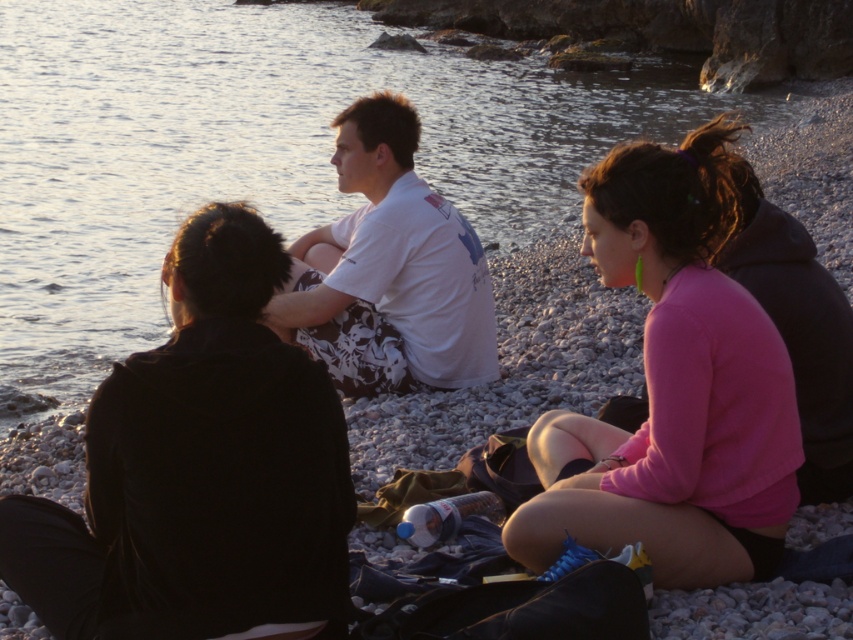
Which is behind, point (281, 504) or point (766, 316)?

Point (766, 316)

Is black matte jacket at left to the right of pink fleece sweatshirt at center from the viewer's perspective?

Incorrect, black matte jacket at left is not on the right side of pink fleece sweatshirt at center.

Which is in front, point (207, 451) or point (654, 349)?

Point (207, 451)

Where is `black matte jacket at left`? The height and width of the screenshot is (640, 853). black matte jacket at left is located at coordinates 218,456.

Can you confirm if clear water at center is wider than pink fleece sweatshirt at center?

Correct, the width of clear water at center exceeds that of pink fleece sweatshirt at center.

Does clear water at center appear on the right side of pink fleece sweatshirt at center?

In fact, clear water at center is to the left of pink fleece sweatshirt at center.

Is point (149, 224) less distant than point (549, 438)?

No, it is behind (549, 438).

Find the location of `clear water at center`. clear water at center is located at coordinates (262, 148).

Who is positioned more to the right, black matte jacket at left or white printed shirt at center?

white printed shirt at center is more to the right.

In the scene shown: Can you confirm if black matte jacket at left is positioned below white printed shirt at center?

Correct, black matte jacket at left is located below white printed shirt at center.

This screenshot has height=640, width=853. What do you see at coordinates (218, 456) in the screenshot?
I see `black matte jacket at left` at bounding box center [218, 456].

Identify the location of black matte jacket at left. (218, 456).